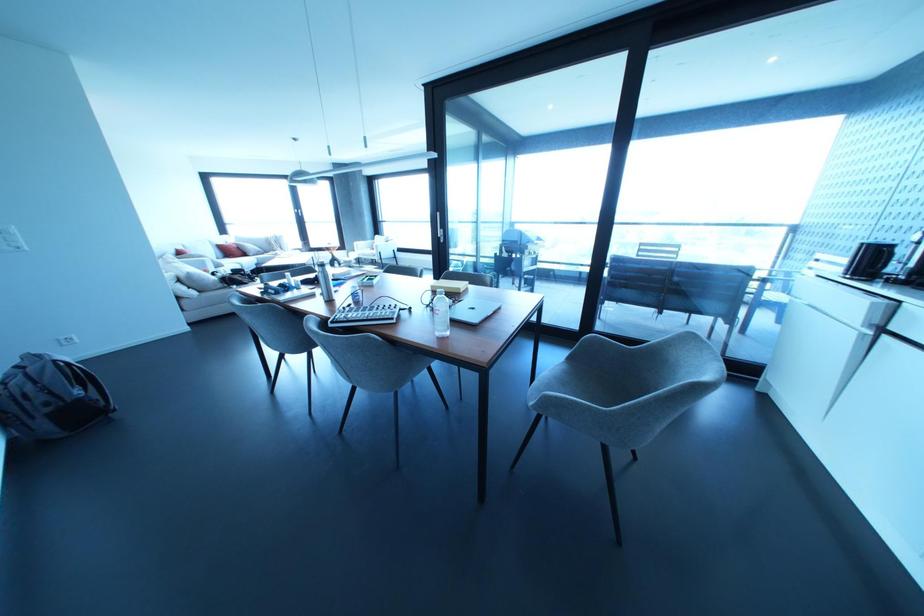
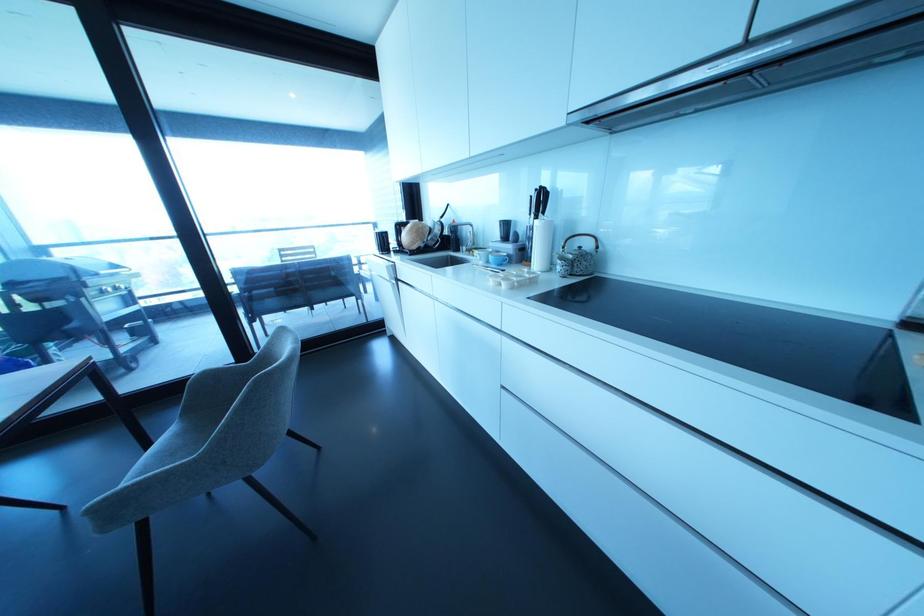
Question: The camera is either moving clockwise (left) or counter-clockwise (right) around the object. The first image is from the beginning of the video and the second image is from the end. Is the camera moving left or right when shooting the video?

Choices:
 (A) Left
 (B) Right

Answer: (A)